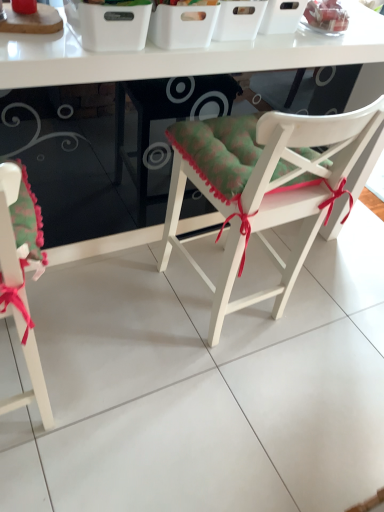
Question: From a real-world perspective, is white plastic basket at upper center physically above matte green cushion at lower left, the 1th chair from the left?

Choices:
 (A) no
 (B) yes

Answer: (B)

Question: Is white plastic basket at upper center smaller than matte green cushion at lower left, the 1th chair from the left?

Choices:
 (A) no
 (B) yes

Answer: (B)

Question: Is white plastic basket at upper center positioned with its back to matte green cushion at lower left, acting as the 2th chair starting from the right?

Choices:
 (A) yes
 (B) no

Answer: (B)

Question: Considering the relative sizes of white plastic basket at upper center and matte green cushion at lower left, acting as the 2th chair starting from the right, in the image provided, is white plastic basket at upper center shorter than matte green cushion at lower left, acting as the 2th chair starting from the right,?

Choices:
 (A) no
 (B) yes

Answer: (B)

Question: From a real-world perspective, does white plastic basket at upper center sit lower than matte green cushion at lower left, the 1th chair from the left?

Choices:
 (A) no
 (B) yes

Answer: (A)

Question: Considering the positions of matte green cushion at lower left, acting as the 2th chair starting from the right, and white plastic basket at upper center in the image, is matte green cushion at lower left, acting as the 2th chair starting from the right, taller or shorter than white plastic basket at upper center?

Choices:
 (A) tall
 (B) short

Answer: (A)

Question: Based on their positions, is matte green cushion at lower left, acting as the 2th chair starting from the right, located to the left or right of white plastic basket at upper center?

Choices:
 (A) left
 (B) right

Answer: (A)

Question: From a real-world perspective, relative to white plastic basket at upper center, is matte green cushion at lower left, acting as the 2th chair starting from the right, vertically above or below?

Choices:
 (A) below
 (B) above

Answer: (A)

Question: Is matte green cushion at lower left, the 1th chair from the left, situated inside white plastic basket at upper center or outside?

Choices:
 (A) outside
 (B) inside

Answer: (A)

Question: From a real-world perspective, relative to white wood chair at center, arranged as the second chair when viewed from the left, is matte green cushion at lower left, acting as the 2th chair starting from the right, vertically above or below?

Choices:
 (A) above
 (B) below

Answer: (B)

Question: In the image, is matte green cushion at lower left, the 1th chair from the left, positioned in front of or behind white wood chair at center, arranged as the 1th chair when viewed from the right?

Choices:
 (A) front
 (B) behind

Answer: (A)

Question: In terms of size, does matte green cushion at lower left, acting as the 2th chair starting from the right, appear bigger or smaller than white wood chair at center, arranged as the second chair when viewed from the left?

Choices:
 (A) small
 (B) big

Answer: (A)

Question: In terms of height, does matte green cushion at lower left, acting as the 2th chair starting from the right, look taller or shorter compared to white wood chair at center, arranged as the 1th chair when viewed from the right?

Choices:
 (A) short
 (B) tall

Answer: (A)

Question: In terms of width, does white glossy table at center look wider or thinner when compared to white plastic basket at upper center?

Choices:
 (A) wide
 (B) thin

Answer: (A)

Question: Is white glossy table at center situated inside white plastic basket at upper center or outside?

Choices:
 (A) outside
 (B) inside

Answer: (A)